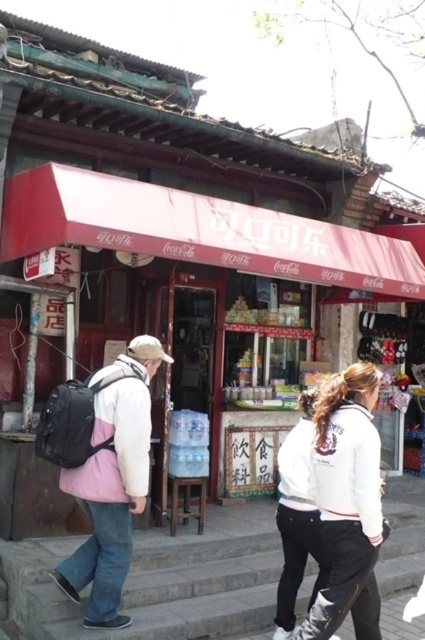
You are a delivery person carrying a box that is 1.5 meters long. You need to place it on the gray concrete steps at lower center or the pink fleece sweatshirt at left. Which location is closer to you?

The gray concrete steps at lower center is 1.38 meters away from the pink fleece sweatshirt at left. Since the distance between them is 1.38 meters, the gray concrete steps at lower center is closer to the pink fleece sweatshirt at left than itself. Therefore, if you are standing near the pink fleece sweatshirt at left, the gray concrete steps at lower center is closer. However, the question states you need to place the box on either location, so you should choose the closer one based on your current stance

You are standing at the entrance of the storefront and need to reach the gray concrete steps at lower center. Which direction should you walk to find them?

The gray concrete steps at lower center are located at point coordinates approximately 0.908 on the x and 0.379 on the y axis. Since the steps are at the lower center of the image, you should walk forward towards the center and slightly to the right from the storefront entrance to reach them.